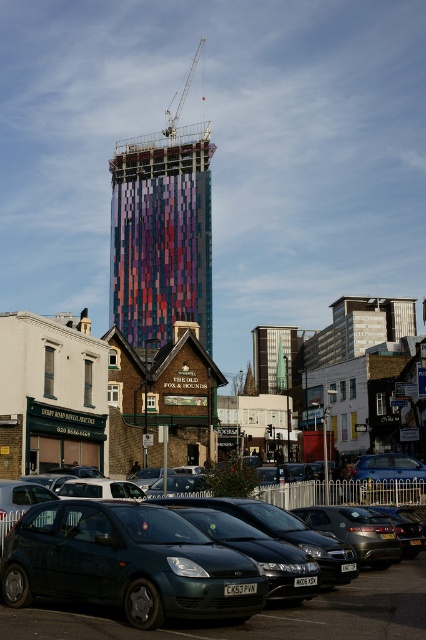
You are a delivery driver who needs to park your truck next to the metallic green hatchback at center and the multicolored mosaic building at center. Based on the space available, which vehicle or building should you park closer to?

The metallic green hatchback at center occupies less space than the multicolored mosaic building at center, so you should park closer to the metallic green hatchback at center to ensure enough space for your truck.

You are a delivery person needing to park your van between the two hatchbacks. The van is 2 meters long. Can you fit it between the metallic green hatchback at center and the metallic gray hatchback at center?

The metallic green hatchback at center is to the left of the metallic gray hatchback at center, but the distance between them isn not provided. Without knowing the space between the two hatchbacks, it is impossible to determine if the van will fit.

You are standing at the point labeled as point (126, 563) in the image. What object are you facing directly?

You are facing the metallic green hatchback at center directly as the point (126, 563) corresponds to it.